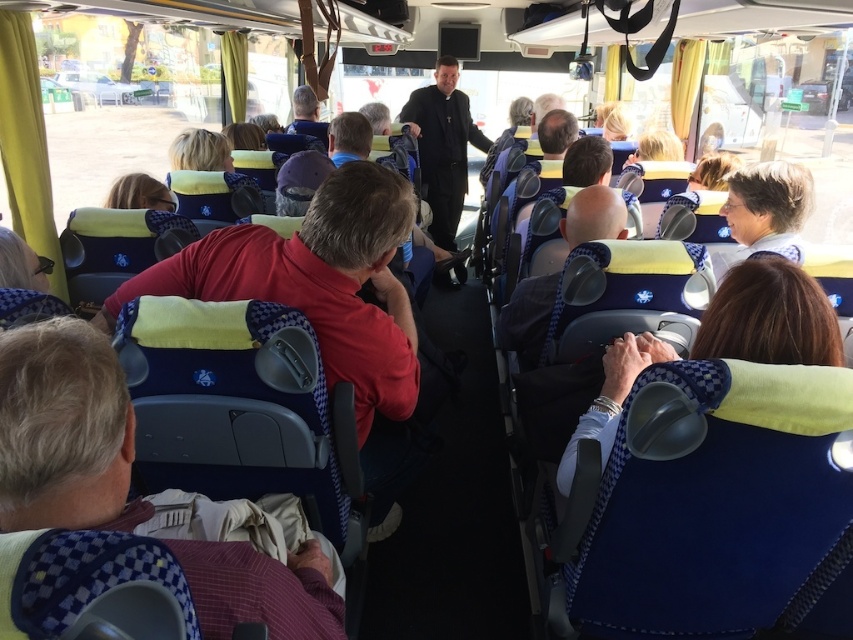
You are a passenger on the bus and want to move from your seat to the front to ask a question. There are two people in front of you wearing the black matte coat at center and the smooth blue shirt at center. Which path would require less space to pass between them?

The path between the black matte coat at center and the smooth blue shirt at center requires more space because the black matte coat at center might be wider than the smooth blue shirt at center.

You are a passenger on the bus and want to place your bag on the seat in front of you. You see the maroon checkered shirt at lower left and the blue textured pillow at center. Which object is closer to you where you can place your bag?

The maroon checkered shirt at lower left is positioned under the blue textured pillow at center, so the maroon checkered shirt at lower left is closer to you and you can place your bag there.